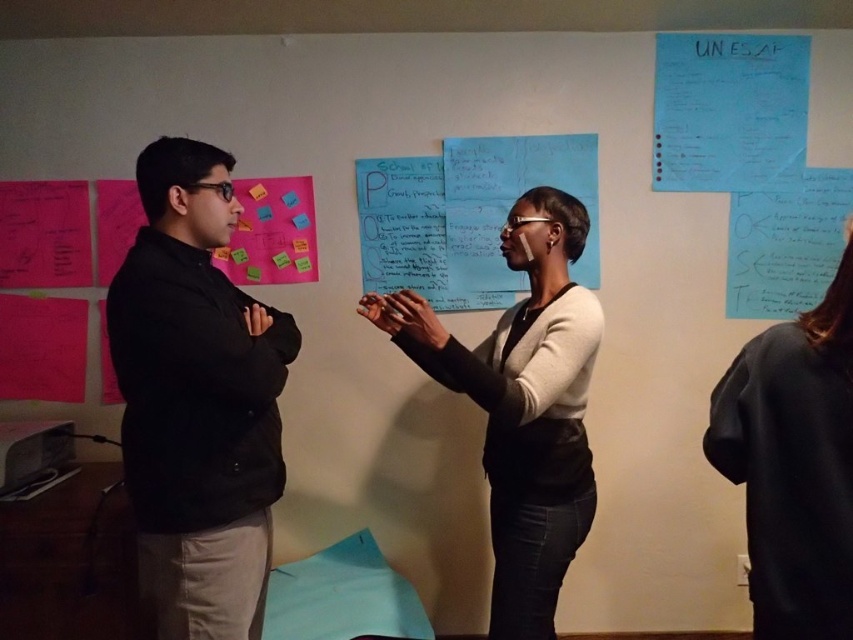
Is white matte sweater at center below bright pink paper at upper left?

Yes, white matte sweater at center is below bright pink paper at upper left.

Between white matte sweater at center and bright pink paper at upper left, which one is positioned higher?

bright pink paper at upper left is above.

The image size is (853, 640). What do you see at coordinates (521, 404) in the screenshot? I see `white matte sweater at center` at bounding box center [521, 404].

You are a GUI agent. You are given a task and a screenshot of the screen. Output one action in this format:
    pyautogui.click(x=<x>, y=<y>)
    Task: Click on the white matte sweater at center
    
    Given the screenshot: What is the action you would take?
    pyautogui.click(x=521, y=404)

Consider the image. Measure the distance between white matte sweater at center and blue paper at upper right.

white matte sweater at center and blue paper at upper right are 3.45 feet apart from each other.

Can you confirm if white matte sweater at center is wider than blue paper at upper right?

No.

Is point (572, 225) farther from viewer compared to point (753, 145)?

No.

Where is `white matte sweater at center`? The width and height of the screenshot is (853, 640). white matte sweater at center is located at coordinates (521, 404).

The image size is (853, 640). Describe the element at coordinates (521, 404) in the screenshot. I see `white matte sweater at center` at that location.

Which is behind, point (564, 413) or point (786, 448)?

The point (564, 413) is more distant.

Between point (500, 516) and point (780, 490), which one is positioned in front?

Point (780, 490) is in front.

Image resolution: width=853 pixels, height=640 pixels. Identify the location of white matte sweater at center. (521, 404).